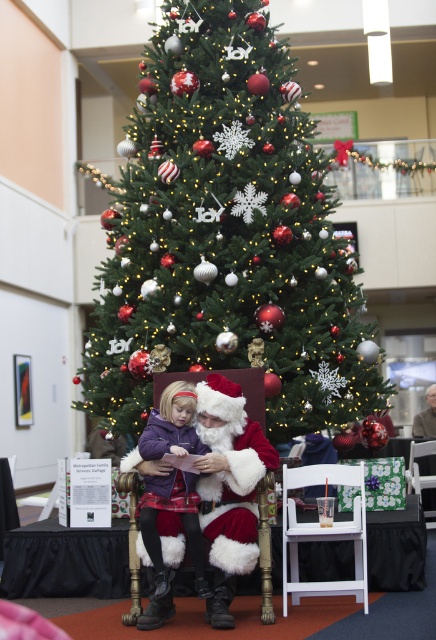
Between point (166, 312) and point (433, 513), which one is positioned behind?

The point (433, 513) is more distant.

Is point (157, 273) farther from viewer compared to point (416, 444)?

That is False.

Find the location of `green matte christmas tree at center`. green matte christmas tree at center is located at coordinates (225, 234).

Can you confirm if purple fleece jacket at center is thinner than white fluffy santa at center?

No.

Where is `purple fleece jacket at center`? This screenshot has height=640, width=436. purple fleece jacket at center is located at coordinates (160, 538).

Does green matte christmas tree at center have a lesser height compared to fuzzy red santa at center?

In fact, green matte christmas tree at center may be taller than fuzzy red santa at center.

From the picture: Is green matte christmas tree at center closer to camera compared to fuzzy red santa at center?

No, it is not.

Is point (184, 67) in front of point (254, 531)?

No.

You are a GUI agent. You are given a task and a screenshot of the screen. Output one action in this format:
    pyautogui.click(x=<x>, y=<y>)
    Task: Click on the green matte christmas tree at center
    
    Given the screenshot: What is the action you would take?
    pyautogui.click(x=225, y=234)